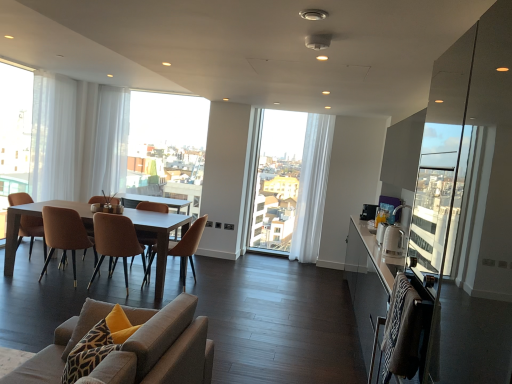
Question: Does white sheer curtain at left, acting as the 2th window screen starting from the right, have a smaller size compared to brown leather chair at center, the fourth chair in the front-to-back sequence?

Choices:
 (A) yes
 (B) no

Answer: (B)

Question: Is the surface of white sheer curtain at left, acting as the 1th window screen starting from the front, in direct contact with brown leather chair at center, the 2th chair when ordered from back to front?

Choices:
 (A) no
 (B) yes

Answer: (A)

Question: Is white sheer curtain at left, acting as the 2th window screen starting from the right, completely or partially outside of brown leather chair at center, the 2th chair when ordered from back to front?

Choices:
 (A) yes
 (B) no

Answer: (A)

Question: Is white sheer curtain at left, which ranks as the 1th window screen in left-to-right order, wider than brown leather chair at center, the 2th chair when ordered from back to front?

Choices:
 (A) no
 (B) yes

Answer: (A)

Question: Does white sheer curtain at left, the 2th window screen in the back-to-front sequence, have a larger size compared to brown leather chair at center, the 2th chair when ordered from back to front?

Choices:
 (A) yes
 (B) no

Answer: (A)

Question: From the image's perspective, is white sheer curtain at left, the 2th window screen in the back-to-front sequence, on brown leather chair at center, the fourth chair in the front-to-back sequence?

Choices:
 (A) no
 (B) yes

Answer: (B)

Question: Is transparent glass window at center to the left of brown leather chair at center, the fourth chair viewed from the back, from the viewer's perspective?

Choices:
 (A) yes
 (B) no

Answer: (B)

Question: Considering the relative sizes of transparent glass window at center and brown leather chair at center, the fourth chair viewed from the back, in the image provided, is transparent glass window at center wider than brown leather chair at center, the fourth chair viewed from the back,?

Choices:
 (A) yes
 (B) no

Answer: (B)

Question: Is transparent glass window at center turned away from brown leather chair at center, the fourth chair viewed from the back?

Choices:
 (A) no
 (B) yes

Answer: (A)

Question: From the image's perspective, is transparent glass window at center on top of brown leather chair at center, the 2th chair from the front?

Choices:
 (A) no
 (B) yes

Answer: (B)

Question: Does transparent glass window at center lie in front of brown leather chair at center, the fourth chair viewed from the back?

Choices:
 (A) yes
 (B) no

Answer: (B)

Question: Can you confirm if transparent glass window at center is bigger than brown leather chair at center, the fourth chair viewed from the back?

Choices:
 (A) no
 (B) yes

Answer: (B)

Question: Considering the relative sizes of white sheer curtain at left, which ranks as the 1th window screen in left-to-right order, and matte wooden table at center in the image provided, is white sheer curtain at left, which ranks as the 1th window screen in left-to-right order, bigger than matte wooden table at center?

Choices:
 (A) yes
 (B) no

Answer: (B)